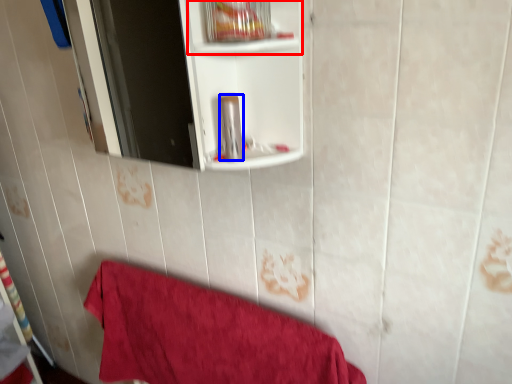
Question: Which point is further to the camera, cabinet (highlighted by a red box) or toiletry (highlighted by a blue box)?

Choices:
 (A) cabinet
 (B) toiletry

Answer: (B)